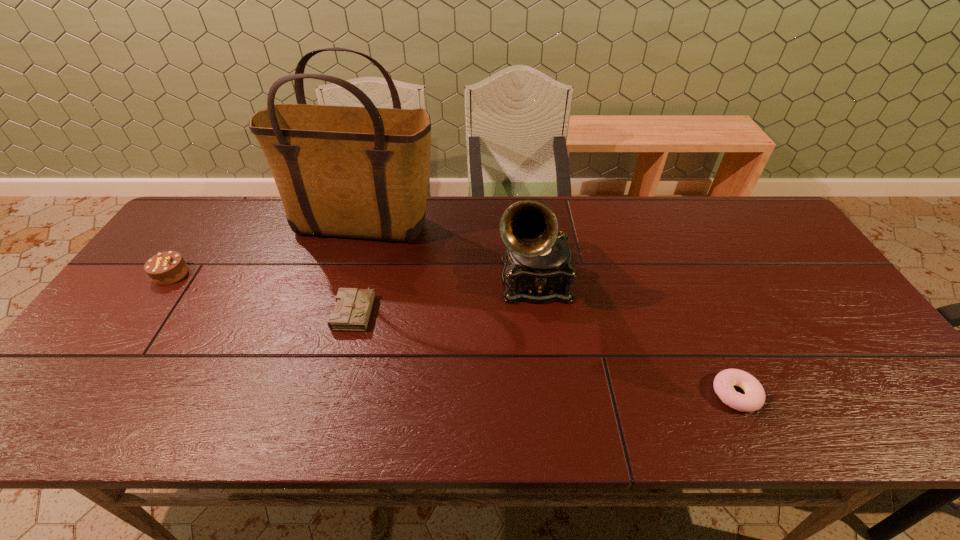
The height and width of the screenshot is (540, 960). In the image, there is a desktop. In order to click on vacant area at the right edge in this screenshot , I will do `click(800, 264)`.

The image size is (960, 540). In the image, there is a desktop. Find the location of `vacant space at the far left corner`. vacant space at the far left corner is located at coordinates (210, 196).

At what (x,y) coordinates should I click in order to perform the action: click on free space at the far right corner of the desktop. Please return your answer as a coordinate pair (x, y). The height and width of the screenshot is (540, 960). Looking at the image, I should click on (772, 234).

Identify the location of free area in between the diary and the doughnut. (545, 352).

Image resolution: width=960 pixels, height=540 pixels. I want to click on unoccupied position between the diary and the tote bag, so click(360, 268).

Locate an element on the screen. Image resolution: width=960 pixels, height=540 pixels. vacant area that lies between the tote bag and the nearest object is located at coordinates (550, 310).

The width and height of the screenshot is (960, 540). I want to click on unoccupied position between the tallest object and the phonograph record, so 449,254.

Identify the location of free space between the third shortest object and the second object from right to left. (352, 277).

Identify the location of vacant point located between the fourth shortest object and the diary. (444, 295).

The image size is (960, 540). I want to click on free space between the farthest object and the fourth object from left to right, so click(x=449, y=254).